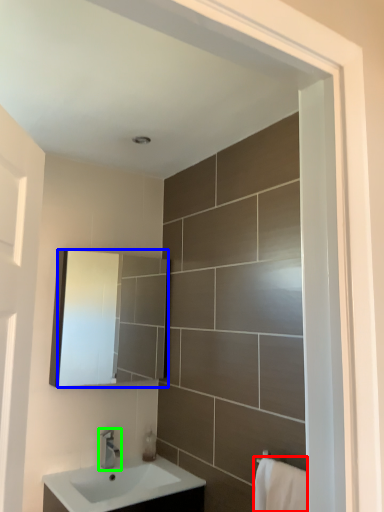
Question: Estimate the real-world distances between objects in this image. Which object is farther from bath towel (highlighted by a red box), mirror (highlighted by a blue box) or tap (highlighted by a green box)?

Choices:
 (A) mirror
 (B) tap

Answer: (A)